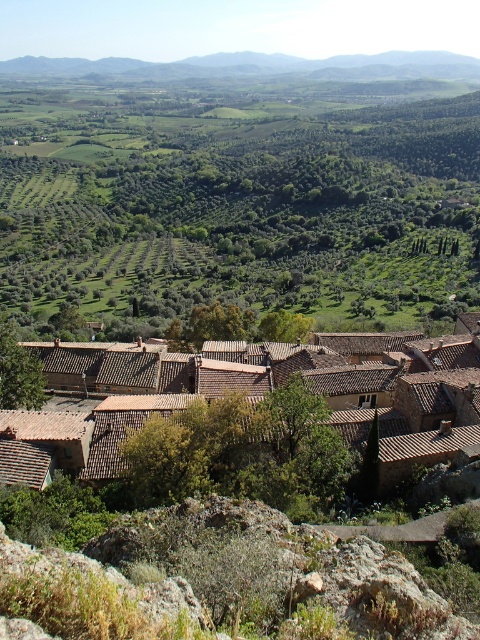
You are an architect designing a new building and want to ensure it fits the village aesthetic. Given the brown clay roof tiles at center and the gray rocky mountain at upper center, which of these two elements has a smaller width in the image?

The brown clay roof tiles at center has a lesser width compared to the gray rocky mountain at upper center, so the brown clay roof tiles at center is the element with the smaller width.

You are standing in the rural landscape and want to take a photo of both the green leafy trees at center and the brown clay roof tiles at center. How far apart are these two features from each other?

The green leafy trees at center is 259.89 meters away from brown clay roof tiles at center.